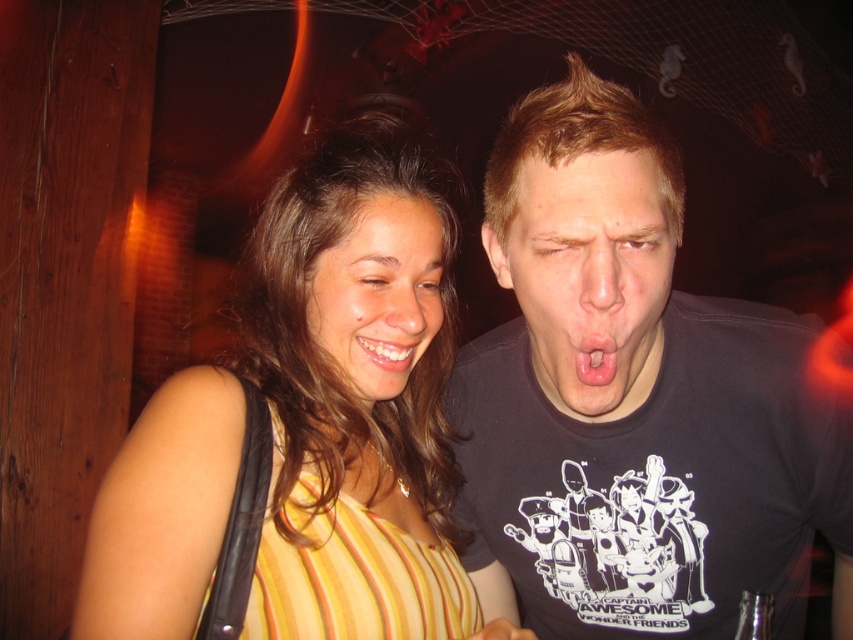
You are a photographer setting up a shoot in this indoor scene. You need to ensure that the yellow striped dress at center and the smooth skin face at center are both in focus. Given their relative sizes, which object should you adjust your camera focus on first to ensure proper depth of field?

The yellow striped dress at center is much taller as smooth skin face at center, so you should focus on the yellow striped dress at center first since larger objects require more careful focus adjustment for depth of field.